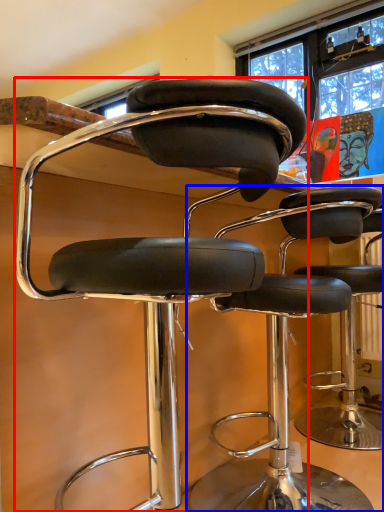
Question: Among these objects, which one is nearest to the camera, chair (highlighted by a red box) or chair (highlighted by a blue box)?

Choices:
 (A) chair
 (B) chair

Answer: (A)